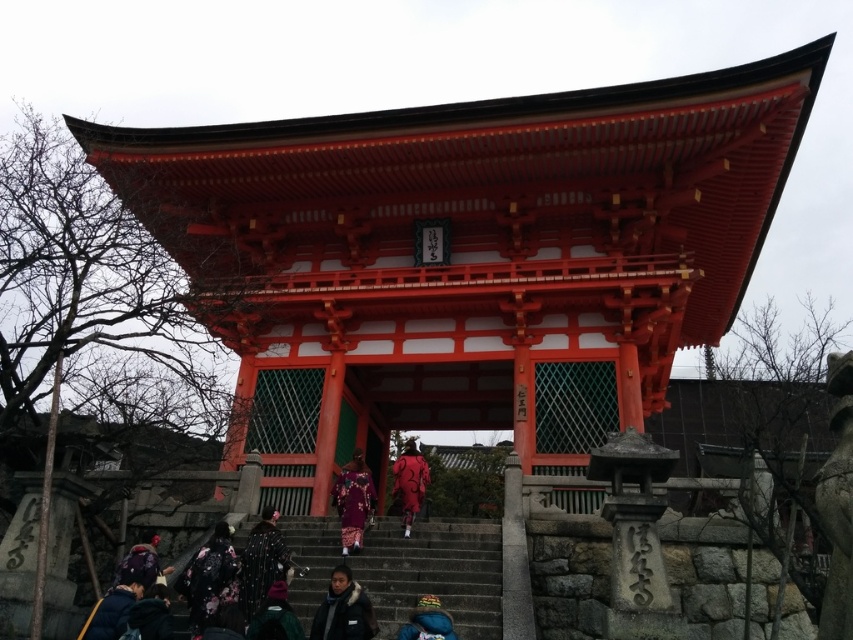
You are standing at the base of the stone steps leading to the shiny red wood gate at center and want to place a 1.5 meter wide decorative mat in front of the gate. Given the width of the gate, will the mat fit comfortably without overlapping the floral kimono at lower left?

The shiny red wood gate at center is wider than the floral kimono at lower left. Since the mat is 1.5 meters wide, it should fit comfortably in front of the gate as long as it is centered and does not extend beyond the gate width, which is larger than the kimono. However, ensure the mat placement doesn not block the path or overlap the floral kimono at lower left.

You are standing at the base of the shrine gate and see the black textured kimono at lower center. If you want to take a closer photo of it without moving, what adjustment should you make to your camera?

Since the black textured kimono at lower center is 11.78 meters away from the camera, you should use a zoom lens to magnify the subject without moving closer.